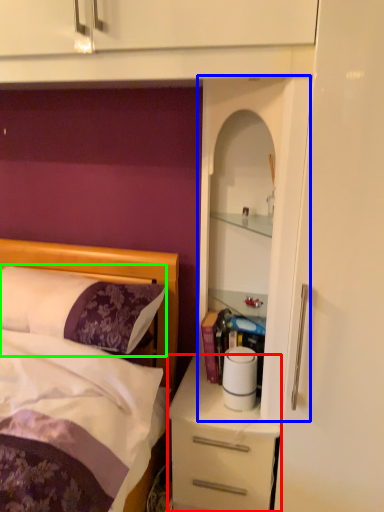
Question: Which is farther away from desk (highlighted by a red box)? cabinet (highlighted by a blue box) or pillow (highlighted by a green box)?

Choices:
 (A) cabinet
 (B) pillow

Answer: (B)